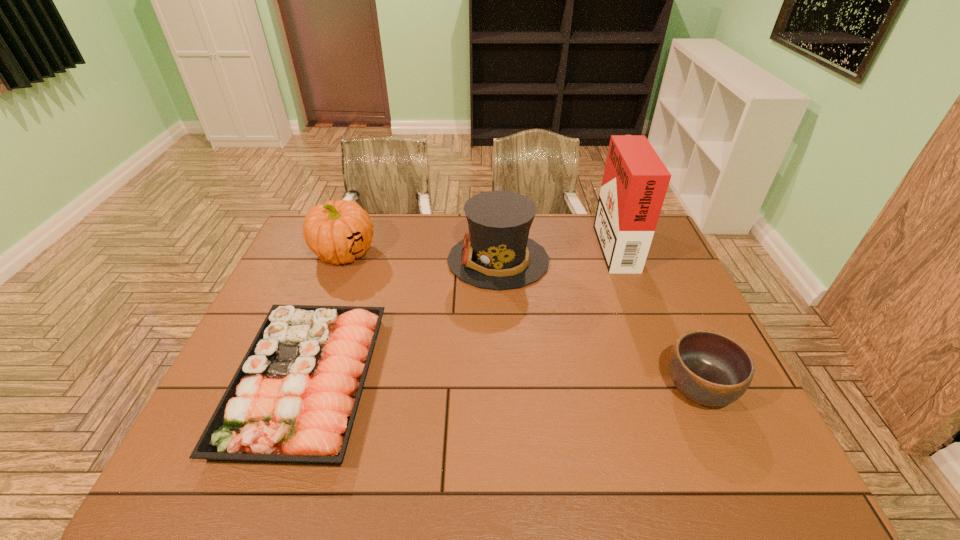
Identify the location of the tallest object. (635, 181).

Where is `the third object from left to right`? This screenshot has height=540, width=960. the third object from left to right is located at coordinates (497, 254).

This screenshot has height=540, width=960. What are the coordinates of `pumpkin` in the screenshot? It's located at (337, 232).

I want to click on the second shortest object, so click(x=709, y=368).

The image size is (960, 540). Find the location of `platter`. platter is located at coordinates (293, 399).

This screenshot has width=960, height=540. In order to click on vacant position located on the front-facing side of the cigarette case in this screenshot , I will do `click(545, 243)`.

Identify the location of vacant space positioned on the front-facing side of the cigarette case. (563, 243).

Locate an element on the screen. free region located on the front-facing side of the cigarette case is located at coordinates (509, 243).

The height and width of the screenshot is (540, 960). Identify the location of free space located 0.300m with goggles on the front of the third object from left to right. (359, 260).

You are a GUI agent. You are given a task and a screenshot of the screen. Output one action in this format:
    pyautogui.click(x=<x>, y=<y>)
    Task: Click on the free point located with goggles on the front of the third object from left to right
    The width and height of the screenshot is (960, 540).
    Given the screenshot: What is the action you would take?
    pos(341,260)